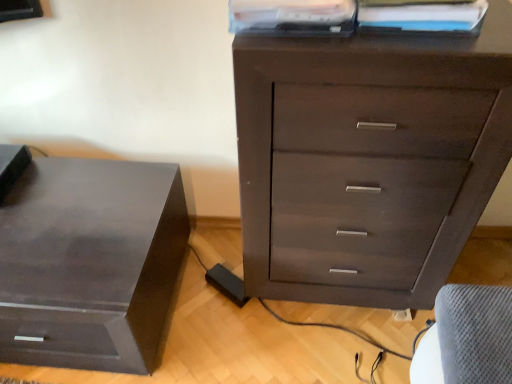
Identify the location of free space above matte black nightstand at left (from a real-world perspective). Image resolution: width=512 pixels, height=384 pixels. (68, 210).